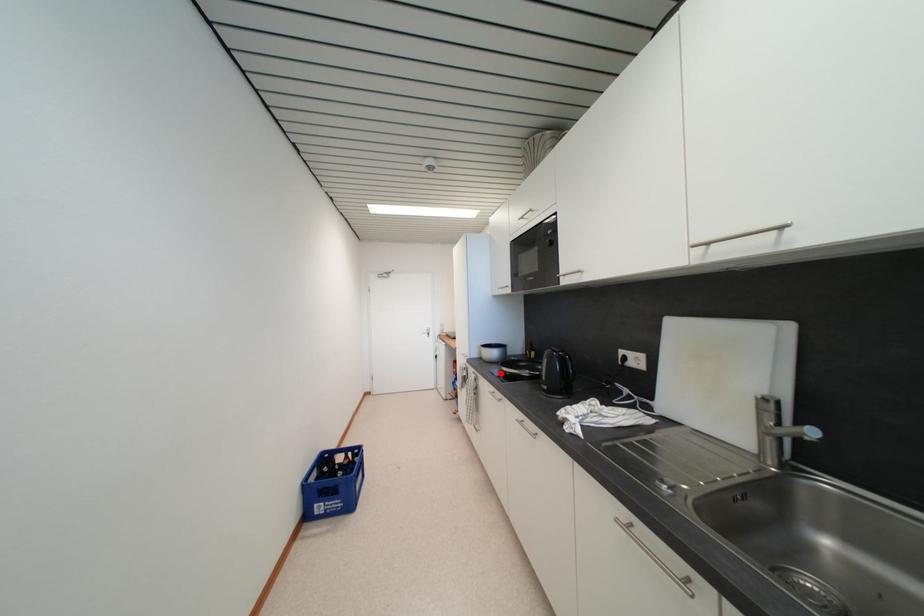
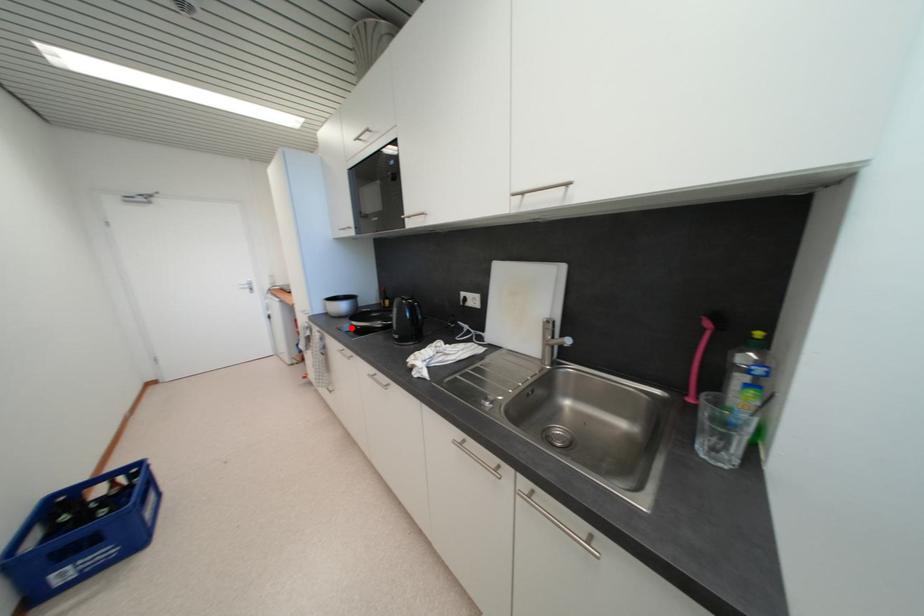
I am providing you with two images of the same scene from different viewpoints. A red point is marked on the first image and another point is marked on the second image. Are the points marked in image1 and image2 representing the same 3D position?

Yes